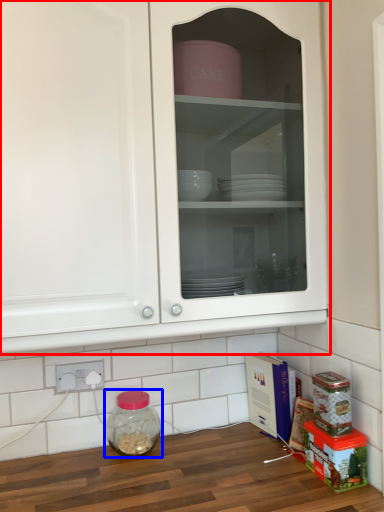
Question: Which object is closer to the camera taking this photo, cabinetry (highlighted by a red box) or glass jar (highlighted by a blue box)?

Choices:
 (A) cabinetry
 (B) glass jar

Answer: (A)